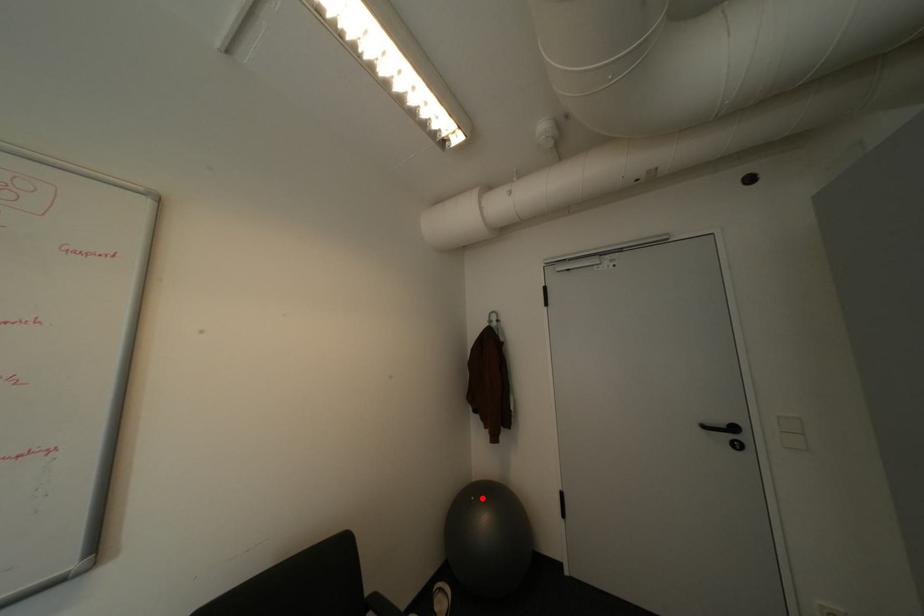
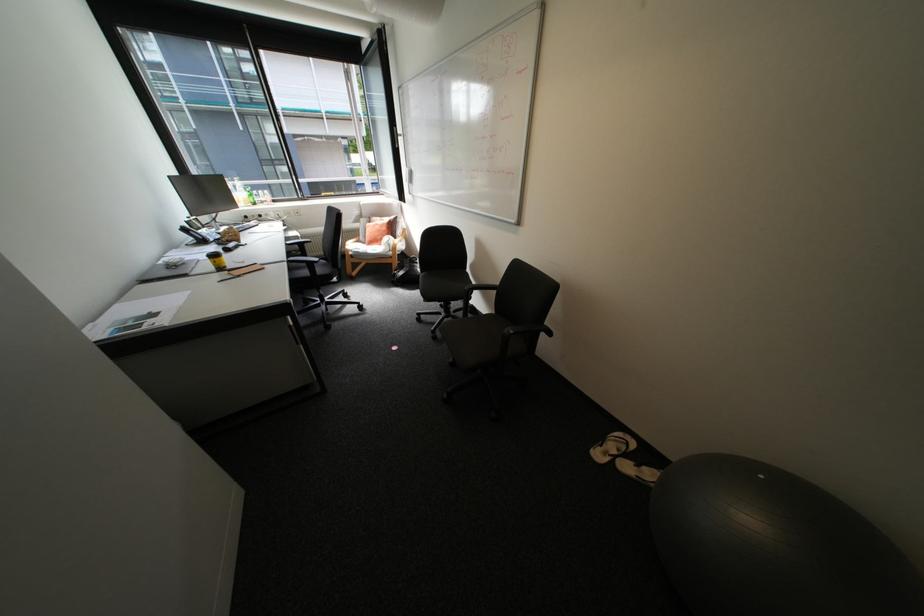
Where in the second image is the point corresponding to the highlighted location from the first image?

(772, 477)